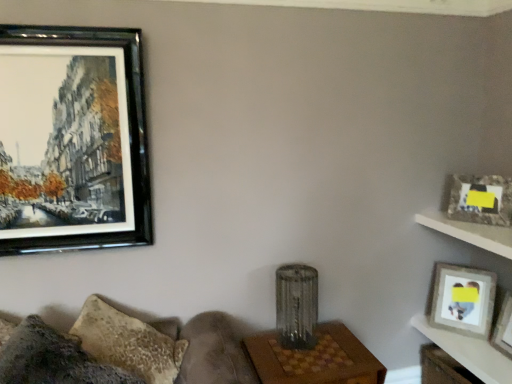
Question: Is black glossy picture frame at upper left, marked as the first picture frame in a top-to-bottom arrangement, taller than textured gray couch at lower left?

Choices:
 (A) yes
 (B) no

Answer: (A)

Question: Is black glossy picture frame at upper left, marked as the first picture frame in a top-to-bottom arrangement, thinner than textured gray couch at lower left?

Choices:
 (A) no
 (B) yes

Answer: (B)

Question: Can you see black glossy picture frame at upper left, which appears as the 3th picture frame when viewed from the right, touching textured gray couch at lower left?

Choices:
 (A) no
 (B) yes

Answer: (A)

Question: From a real-world perspective, is black glossy picture frame at upper left, which appears as the 3th picture frame when viewed from the right, on top of textured gray couch at lower left?

Choices:
 (A) no
 (B) yes

Answer: (B)

Question: Is black glossy picture frame at upper left, marked as the first picture frame in a top-to-bottom arrangement, turned away from textured gray couch at lower left?

Choices:
 (A) no
 (B) yes

Answer: (A)

Question: Is wooden table at center, which is the 2th table from right to left, inside or outside of black glossy picture frame at upper left, which appears as the 3th picture frame when viewed from the right?

Choices:
 (A) outside
 (B) inside

Answer: (A)

Question: Is point (275, 379) positioned closer to the camera than point (79, 182)?

Choices:
 (A) farther
 (B) closer

Answer: (B)

Question: Is wooden table at center, which is the 2th table from right to left, wider or thinner than black glossy picture frame at upper left, which appears as the 3th picture frame when viewed from the right?

Choices:
 (A) thin
 (B) wide

Answer: (B)

Question: In the image, is wooden table at center, which is the 2th table from right to left, on the left side or the right side of black glossy picture frame at upper left, which is the 3th picture frame in bottom-to-top order?

Choices:
 (A) right
 (B) left

Answer: (A)

Question: In terms of width, does wooden table at lower right, which is the 1th table in right-to-left order, look wider or thinner when compared to metallic textured lamp at center?

Choices:
 (A) wide
 (B) thin

Answer: (A)

Question: From the image's perspective, is wooden table at lower right, which is the 1th table in right-to-left order, positioned above or below metallic textured lamp at center?

Choices:
 (A) below
 (B) above

Answer: (A)

Question: Relative to metallic textured lamp at center, is wooden table at lower right, which is the 1th table in right-to-left order, in front or behind?

Choices:
 (A) behind
 (B) front

Answer: (B)

Question: In terms of height, does wooden table at lower right, which is the 1th table in right-to-left order, look taller or shorter compared to metallic textured lamp at center?

Choices:
 (A) short
 (B) tall

Answer: (A)

Question: Does point pos(347,360) appear closer or farther from the camera than point pos(458,336)?

Choices:
 (A) closer
 (B) farther

Answer: (A)

Question: Is wooden table at center, which is the 2th table from right to left, spatially inside wooden table at lower right, positioned as the 2th table in left-to-right order, or outside of it?

Choices:
 (A) inside
 (B) outside

Answer: (B)